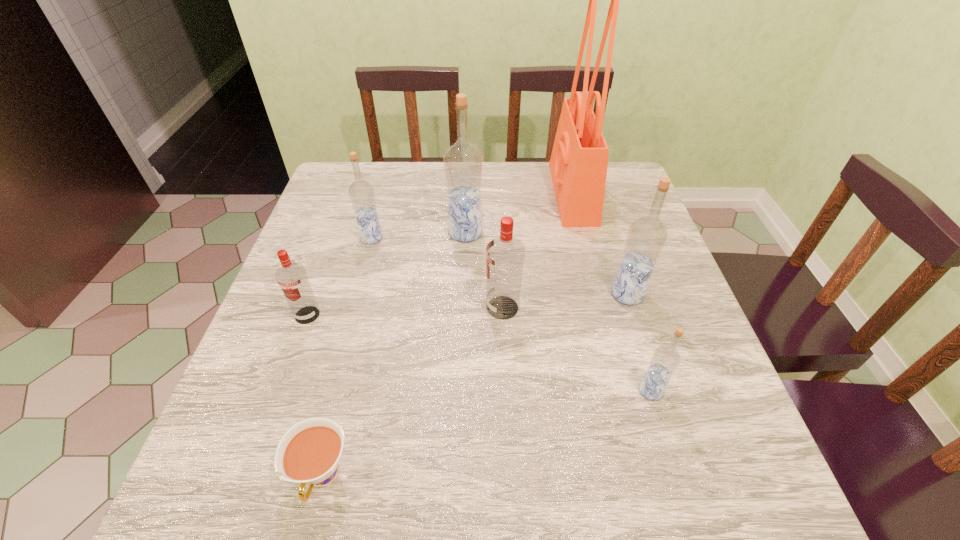
Locate an element on the screen. the leftmost vodka is located at coordinates (292, 278).

Where is `the smallest blue vodka`? Image resolution: width=960 pixels, height=540 pixels. the smallest blue vodka is located at coordinates (665, 360).

What are the coordinates of `the nearest vodka` in the screenshot? It's located at (665, 360).

Where is `the nearest object`? The width and height of the screenshot is (960, 540). the nearest object is located at coordinates (309, 452).

Where is `the shortest object`? the shortest object is located at coordinates (309, 452).

The height and width of the screenshot is (540, 960). What are the coordinates of `vacant point located on the logo side of the tote bag` in the screenshot? It's located at (443, 193).

The height and width of the screenshot is (540, 960). I want to click on free space located 0.060m on the logo side of the tote bag, so click(x=533, y=193).

You are a GUI agent. You are given a task and a screenshot of the screen. Output one action in this format:
    pyautogui.click(x=<x>, y=<y>)
    Task: Click on the free region located on the logo side of the tote bag
    The image size is (960, 540).
    Given the screenshot: What is the action you would take?
    pyautogui.click(x=529, y=193)

Find the location of a particular element. free space located on the back of the tallest vodka is located at coordinates (467, 194).

Where is `vacant space located on the left of the sixth shortest object`? The image size is (960, 540). vacant space located on the left of the sixth shortest object is located at coordinates (455, 294).